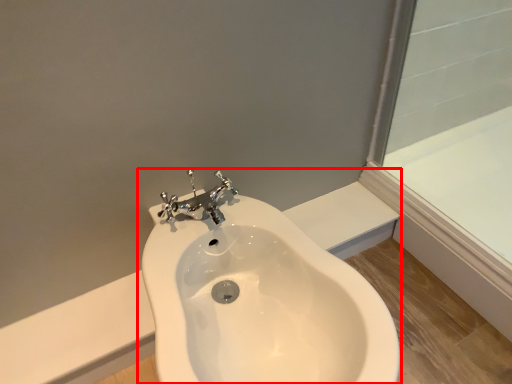
Question: From the image, what is the correct spatial relationship of sink (annotated by the red box) in relation to bath?

Choices:
 (A) right
 (B) left

Answer: (B)